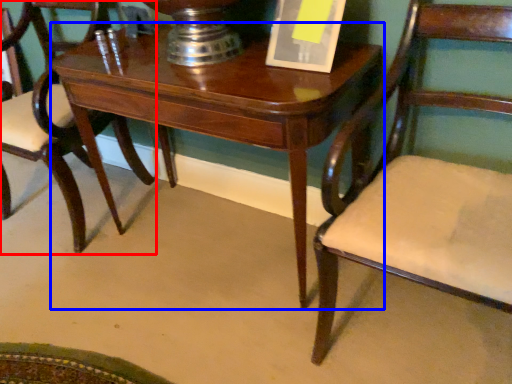
Question: Which object is further to the camera taking this photo, chair (highlighted by a red box) or table (highlighted by a blue box)?

Choices:
 (A) chair
 (B) table

Answer: (A)